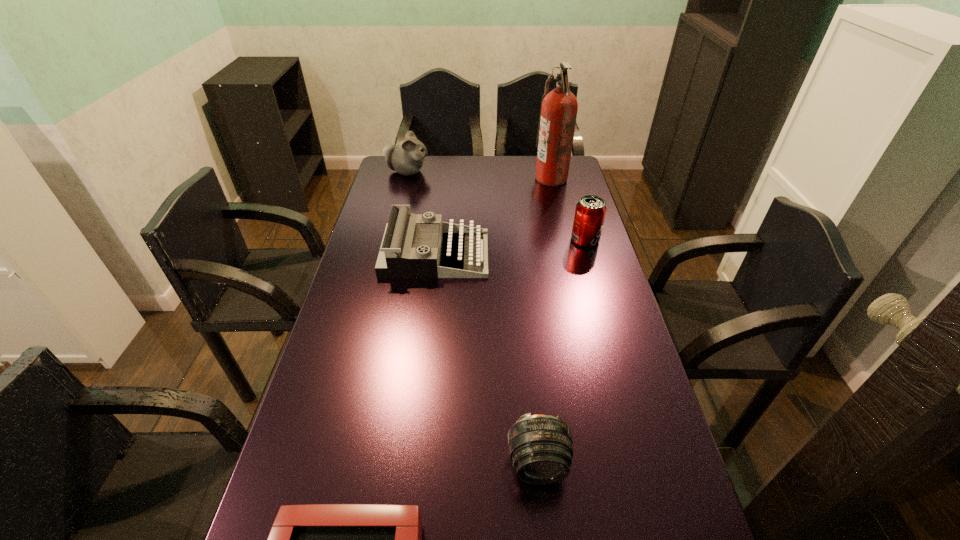
Find the location of `object present at the far right corner`. object present at the far right corner is located at coordinates (558, 111).

Where is `free space at the far edge of the desktop`? This screenshot has height=540, width=960. free space at the far edge of the desktop is located at coordinates (480, 172).

The image size is (960, 540). Identify the location of vacant region at the left edge of the desktop. (386, 225).

At what (x,y) coordinates should I click in order to perform the action: click on free space at the right edge of the desktop. Please return your answer as a coordinate pair (x, y). The image size is (960, 540). Looking at the image, I should click on (588, 388).

Where is `vacant point located between the taller typewriter and the tallest object`? This screenshot has height=540, width=960. vacant point located between the taller typewriter and the tallest object is located at coordinates (493, 216).

Where is `empty space between the fourth object from left to right and the soda can`? empty space between the fourth object from left to right and the soda can is located at coordinates (562, 352).

Locate an element on the screen. The image size is (960, 540). unoccupied area between the fire extinguisher and the soda can is located at coordinates [568, 209].

Where is `empty space between the fifth farthest object and the tallest object`? The image size is (960, 540). empty space between the fifth farthest object and the tallest object is located at coordinates (544, 321).

What are the coordinates of `free area in between the farther typewriter and the tallest object` in the screenshot? It's located at (493, 216).

Identify which object is the nearest to the hamster. Please provide its 2D coordinates. Your answer should be formatted as a tuple, i.e. [(x, y)], where the tuple contains the x and y coordinates of a point satisfying the conditions above.

[(397, 258)]